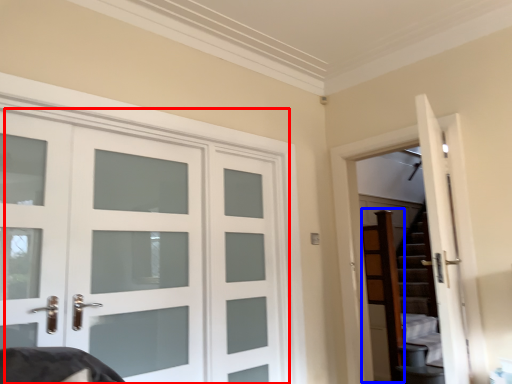
Question: Among these objects, which one is nearest to the camera, door (highlighted by a red box) or dresser (highlighted by a blue box)?

Choices:
 (A) door
 (B) dresser

Answer: (A)